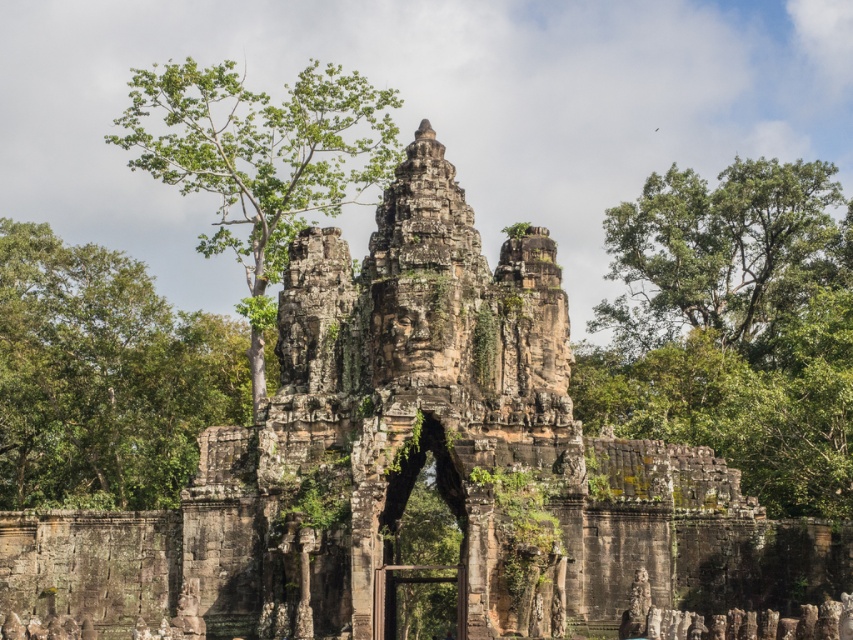
Question: Does green leafy tree at left have a greater width compared to green leafy tree at upper left?

Choices:
 (A) no
 (B) yes

Answer: (A)

Question: Which point is closer to the camera?

Choices:
 (A) (86, 435)
 (B) (683, 323)
 (C) (363, 77)

Answer: (A)

Question: Is green leafy tree at right positioned at the back of green leafy tree at left?

Choices:
 (A) yes
 (B) no

Answer: (B)

Question: Among these objects, which one is nearest to the camera?

Choices:
 (A) green leafy tree at upper left
 (B) green leafy tree at right

Answer: (B)

Question: Which object appears closest to the camera in this image?

Choices:
 (A) green leafy tree at left
 (B) green leafy tree at right
 (C) green leafy tree at upper left

Answer: (B)

Question: Can you confirm if green leafy tree at right is smaller than green leafy tree at upper left?

Choices:
 (A) no
 (B) yes

Answer: (B)